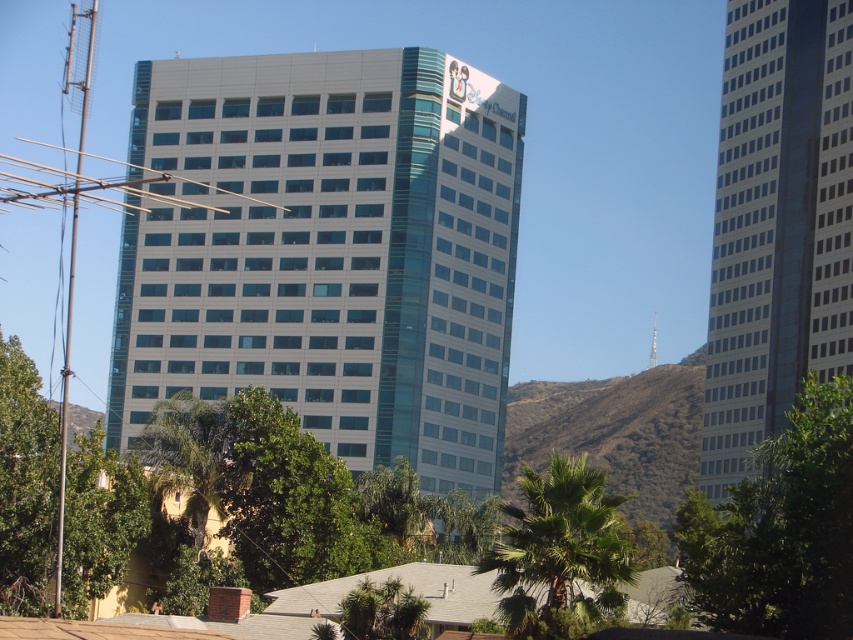
Question: Does matte glass building at center come behind glassy white skyscraper at right?

Choices:
 (A) no
 (B) yes

Answer: (A)

Question: Can you confirm if matte glass building at center is smaller than glassy white skyscraper at right?

Choices:
 (A) yes
 (B) no

Answer: (B)

Question: Is glassy white skyscraper at right thinner than green leafy tree at right?

Choices:
 (A) no
 (B) yes

Answer: (B)

Question: Which point is closer to the camera taking this photo?

Choices:
 (A) (741, 392)
 (B) (28, 525)
 (C) (601, 499)

Answer: (C)

Question: Which point is closer to the camera?

Choices:
 (A) green leafy tree at right
 (B) matte glass building at center
 (C) green leafy tree at lower left

Answer: (A)

Question: Which point is closer to the camera?

Choices:
 (A) (527, 500)
 (B) (91, 561)

Answer: (A)